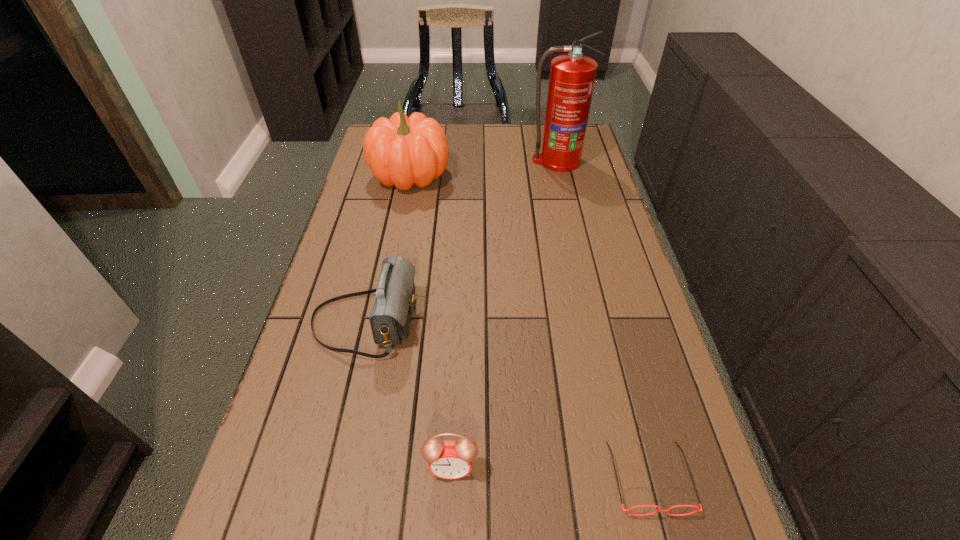
Locate an element on the screen. This screenshot has width=960, height=540. fire extinguisher that is positioned at the far edge is located at coordinates (572, 76).

Where is `pumpkin situated at the far edge`? The height and width of the screenshot is (540, 960). pumpkin situated at the far edge is located at coordinates (401, 151).

The height and width of the screenshot is (540, 960). Find the location of `pumpkin that is positioned at the left edge`. pumpkin that is positioned at the left edge is located at coordinates (401, 151).

Find the location of a particular element. shoulder bag present at the left edge is located at coordinates (390, 318).

Where is `fire extinguisher that is at the right edge`? fire extinguisher that is at the right edge is located at coordinates (572, 76).

Where is `spectacles situated at the right edge`? This screenshot has height=540, width=960. spectacles situated at the right edge is located at coordinates (657, 510).

Locate an element on the screen. This screenshot has height=540, width=960. object present at the far left corner is located at coordinates (401, 151).

In order to click on object that is at the far right corner in this screenshot , I will do `click(572, 76)`.

In the image, there is a desktop. At what (x,y) coordinates should I click in order to perform the action: click on vacant area at the far edge. Please return your answer as a coordinate pair (x, y). The height and width of the screenshot is (540, 960). Looking at the image, I should click on (489, 145).

Locate an element on the screen. This screenshot has width=960, height=540. vacant space at the left edge of the desktop is located at coordinates (354, 420).